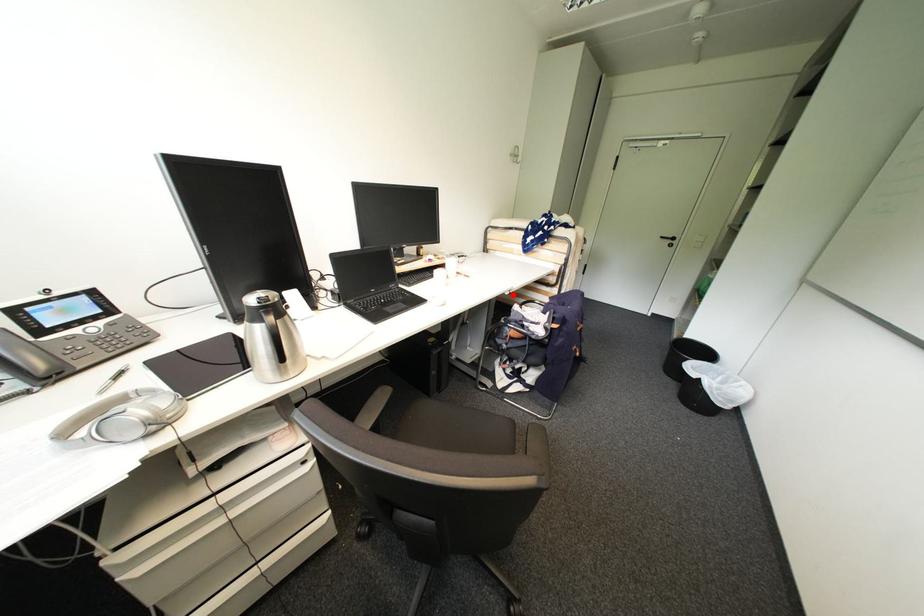
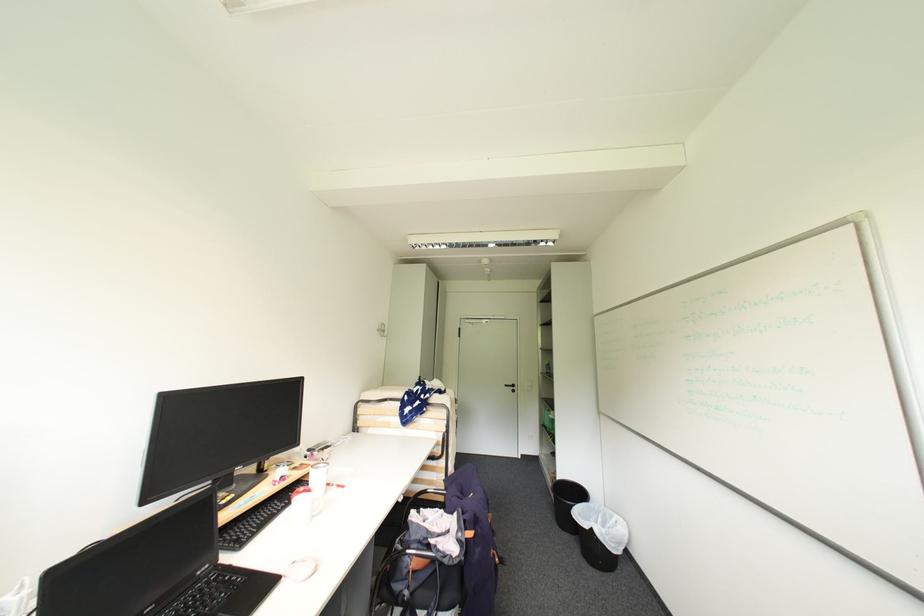
In the second image, find the point that corresponds to the highlighted location in the first image.

(407, 501)